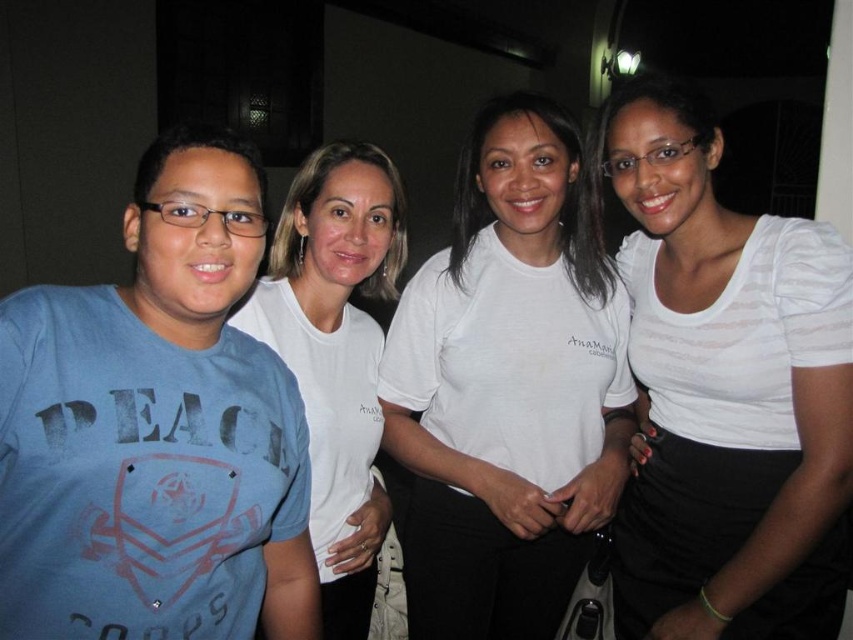
Question: Which object is farther from the camera taking this photo?

Choices:
 (A) white cotton t-shirt at center
 (B) blue matte t-shirt at left
 (C) white cotton shirt at center

Answer: (C)

Question: Which point appears closest to the camera in this image?

Choices:
 (A) (358, 616)
 (B) (715, 124)
 (C) (496, 132)

Answer: (B)

Question: From the image, what is the correct spatial relationship of white textured shirt at center in relation to white cotton t-shirt at center?

Choices:
 (A) right
 (B) left

Answer: (A)

Question: Does white cotton shirt at center appear on the right side of white cotton t-shirt at center?

Choices:
 (A) no
 (B) yes

Answer: (B)

Question: Is blue matte t-shirt at left wider than white textured shirt at center?

Choices:
 (A) yes
 (B) no

Answer: (B)

Question: Which of the following is the closest to the observer?

Choices:
 (A) (329, 262)
 (B) (154, 480)

Answer: (B)